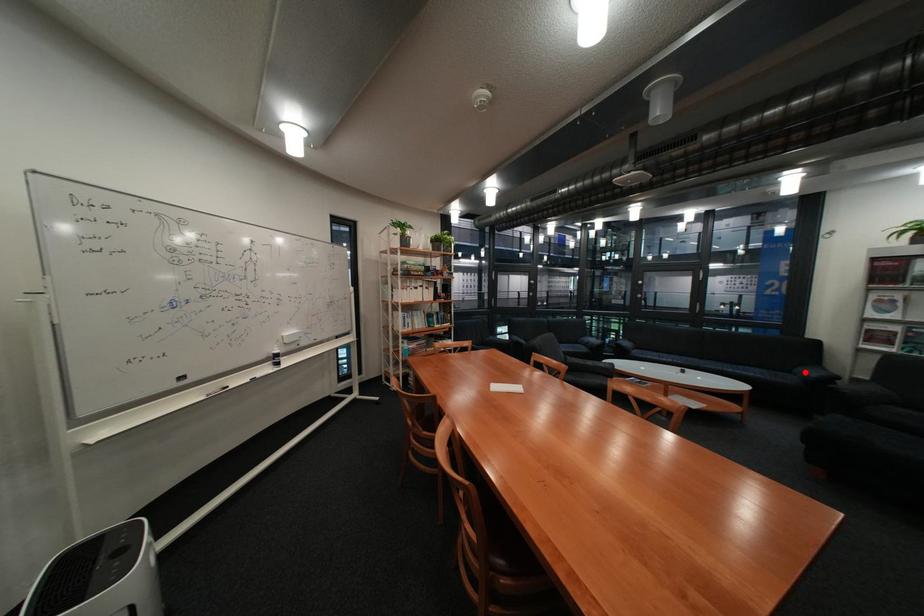
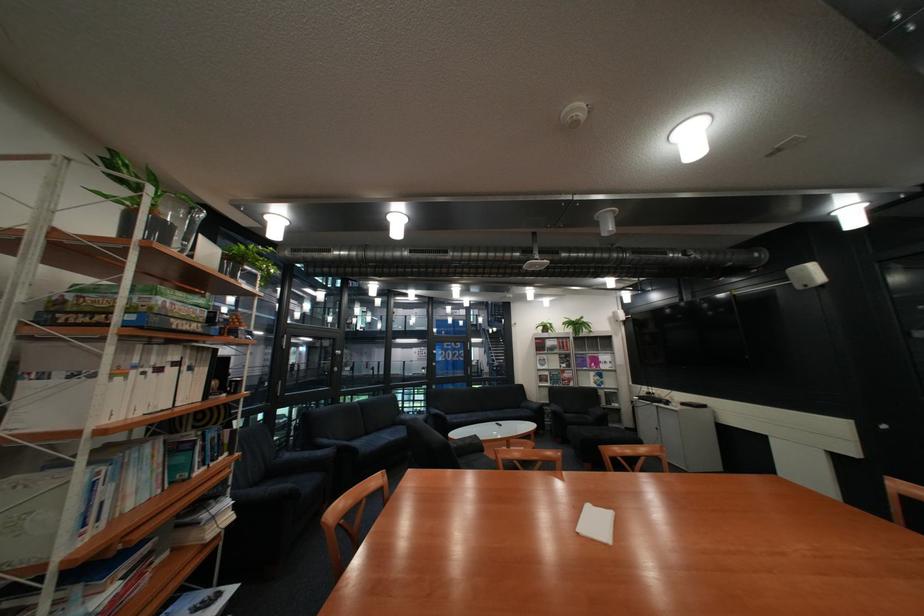
Locate, in the second image, the point that corresponds to the highlighted location in the first image.

(535, 408)